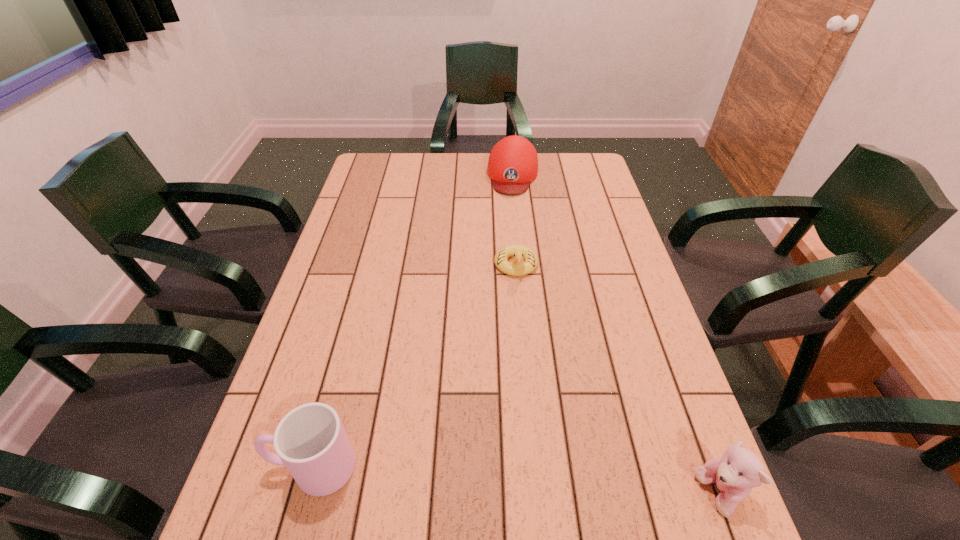
Image resolution: width=960 pixels, height=540 pixels. I want to click on empty space between the cup and the farthest object, so click(413, 321).

Locate an element on the screen. This screenshot has width=960, height=540. free spot between the shortest object and the baseball cap is located at coordinates (515, 220).

This screenshot has height=540, width=960. I want to click on empty space between the baseball cap and the leftmost object, so click(413, 321).

The width and height of the screenshot is (960, 540). In order to click on free spot between the rightmost object and the duckling in this screenshot , I will do `click(617, 380)`.

Where is `vacant area between the farthest object and the rightmost object`? The image size is (960, 540). vacant area between the farthest object and the rightmost object is located at coordinates (616, 334).

Select which object appears as the closest to the teddy bear. Please provide its 2D coordinates. Your answer should be formatted as a tuple, i.e. [(x, y)], where the tuple contains the x and y coordinates of a point satisfying the conditions above.

[(519, 268)]

At what (x,y) coordinates should I click in order to perform the action: click on object that is the third nearest to the rightmost object. Please return your answer as a coordinate pair (x, y). Looking at the image, I should click on (513, 162).

The width and height of the screenshot is (960, 540). In order to click on free location that satisfies the following two spatial constraints: 1. on the front side of the teddy bear; 2. at the face of the baseball cap in this screenshot , I will do `click(545, 494)`.

I want to click on vacant space that satisfies the following two spatial constraints: 1. on the front side of the farthest object; 2. at the face of the rightmost object, so click(545, 494).